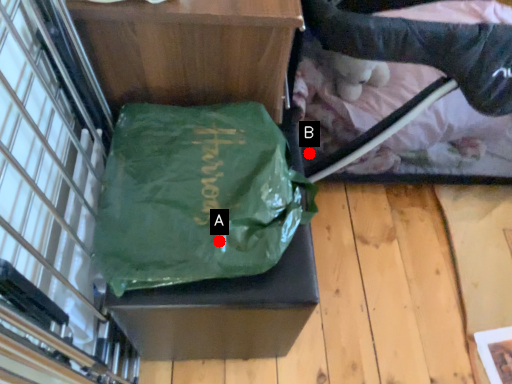
Question: Two points are circled on the image, labeled by A and B beside each circle. Which of the following is the farthest from the observer?

Choices:
 (A) A is further
 (B) B is further

Answer: (B)